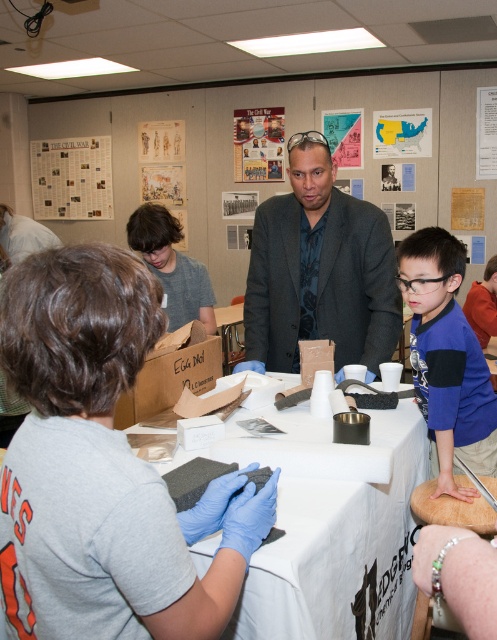
Is point (301, 541) behind point (358, 356)?

That is False.

Can you confirm if white paper towel at center is positioned to the right of dark gray suit at center?

Indeed, white paper towel at center is positioned on the right side of dark gray suit at center.

This screenshot has width=497, height=640. Find the location of `white paper towel at center`. white paper towel at center is located at coordinates [x=331, y=525].

The width and height of the screenshot is (497, 640). I want to click on white paper towel at center, so click(331, 525).

Can you confirm if white paper towel at center is thinner than matte paper bulletin board at upper left?

No.

Is point (309, 474) less distant than point (40, 144)?

That is True.

The image size is (497, 640). Identify the location of white paper towel at center. (331, 525).

Does matte paper bulletin board at upper left have a larger size compared to wooden cutting board at center?

Yes, matte paper bulletin board at upper left is bigger than wooden cutting board at center.

Between point (78, 216) and point (441, 506), which one is positioned behind?

The point (78, 216) is more distant.

Where is `matte paper bulletin board at upper left`? This screenshot has width=497, height=640. matte paper bulletin board at upper left is located at coordinates (72, 179).